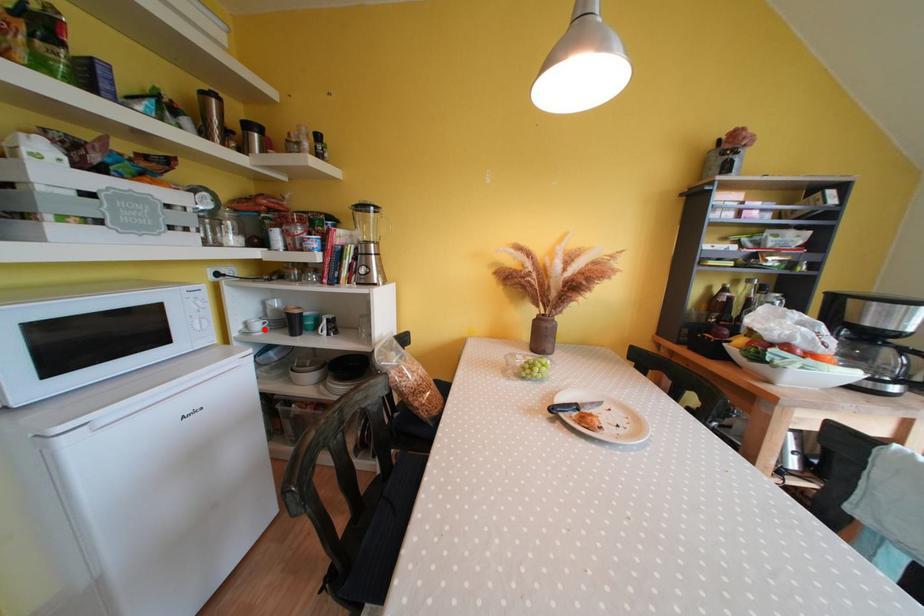
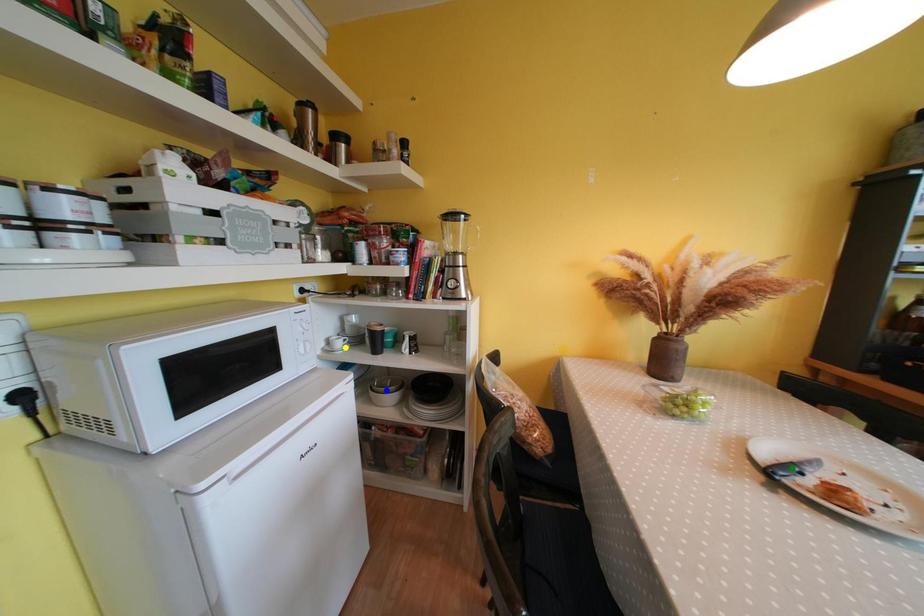
Question: I am providing you with two images of the same scene from different viewpoints. A red point is marked on the first image. You are given multiple points on the second image. Which spot in image 2 lines up with the point in image 1?

Choices:
 (A) blue point
 (B) green point
 (C) yellow point

Answer: (C)